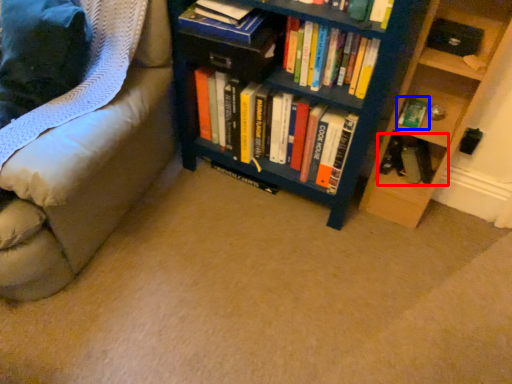
Question: Which of the following is the farthest to the observer, book (highlighted by a red box) or book (highlighted by a blue box)?

Choices:
 (A) book
 (B) book

Answer: (A)